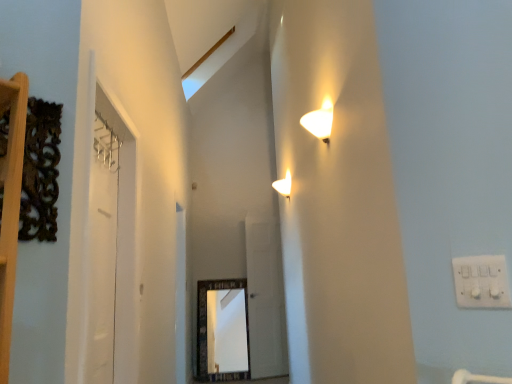
Question: In terms of width, does transparent glass door at center, which is the second glass door from left to right, look wider or thinner when compared to white glossy wall sconce at upper center?

Choices:
 (A) thin
 (B) wide

Answer: (A)

Question: Considering their positions, is transparent glass door at center, placed as the 1th glass door when sorted from back to front, located in front of or behind white glossy wall sconce at upper center?

Choices:
 (A) behind
 (B) front

Answer: (A)

Question: Based on their relative distances, which object is nearer to the transparent glass door at center, the first glass door viewed from the right?

Choices:
 (A) clear glass door at left, the second glass door positioned from the back
 (B) white glossy wall sconce at upper center
 (C) white glossy door at left
 (D) white plastic electric outlet at upper right

Answer: (B)

Question: Which object is positioned closest to the white glossy wall sconce at upper center?

Choices:
 (A) clear glass door at left, which appears as the 1th glass door when viewed from the front
 (B) transparent glass door at center, the first glass door viewed from the right
 (C) white plastic electric outlet at upper right
 (D) white glossy door at left

Answer: (C)